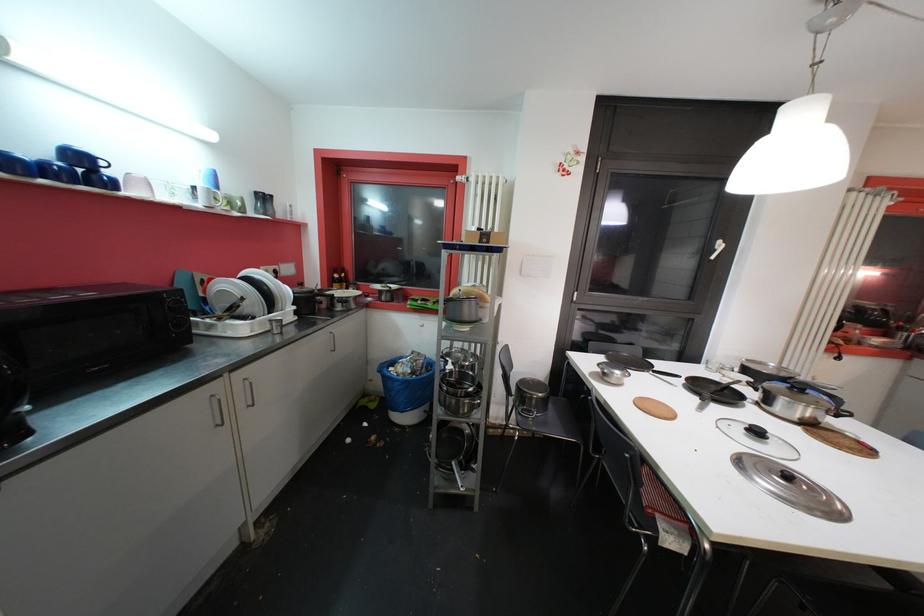
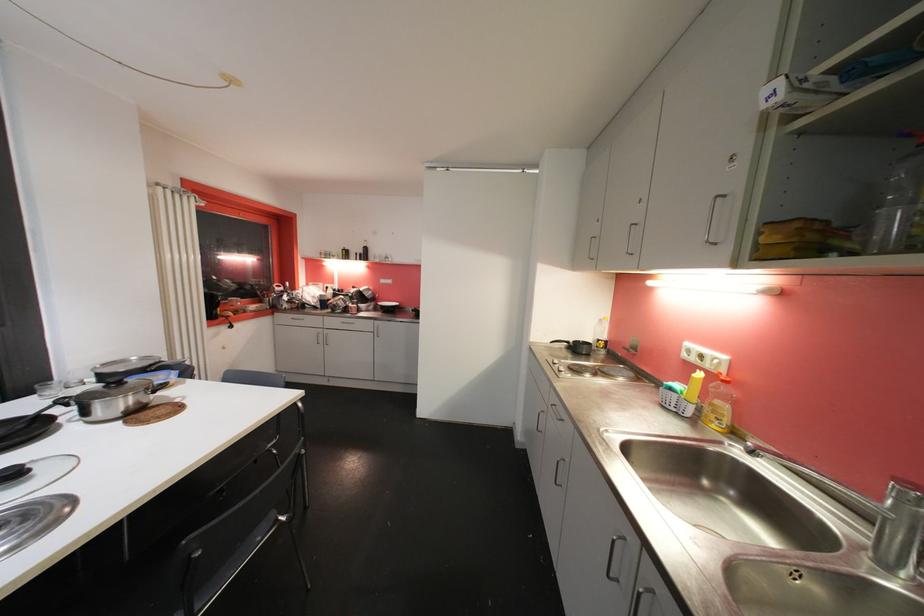
Question: The first image is from the beginning of the video and the second image is from the end. How did the camera likely rotate when shooting the video?

Choices:
 (A) Left
 (B) Right
 (C) Up
 (D) Down

Answer: (B)